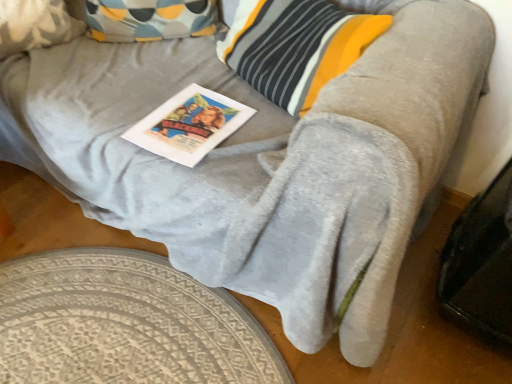
Where is `white paper magazine at center`? white paper magazine at center is located at coordinates (189, 125).

Locate an element on the screen. The height and width of the screenshot is (384, 512). fluffy beige pillow at upper left is located at coordinates 35,25.

What is the approximate height of textured beige rug at lower left?

It is 0.85 inches.

Where is `white paper magazine at center`? white paper magazine at center is located at coordinates (189, 125).

In the scene shown: Is white paper magazine at center wider or thinner than fluffy beige pillow at upper left?

white paper magazine at center is wider than fluffy beige pillow at upper left.

From a real-world perspective, is white paper magazine at center physically below fluffy beige pillow at upper left?

Yes, from a real-world perspective, white paper magazine at center is under fluffy beige pillow at upper left.

Is white paper magazine at center at the right side of fluffy beige pillow at upper left?

Correct, you'll find white paper magazine at center to the right of fluffy beige pillow at upper left.

Would you say white paper magazine at center contains fluffy beige pillow at upper left?

No, white paper magazine at center does not contain fluffy beige pillow at upper left.

From the image's perspective, does fluffy beige pillow at upper left appear lower than textured beige rug at lower left?

Actually, fluffy beige pillow at upper left appears above textured beige rug at lower left in the image.

Is fluffy beige pillow at upper left thinner than textured beige rug at lower left?

Correct, the width of fluffy beige pillow at upper left is less than that of textured beige rug at lower left.

Does point (56, 29) come closer to viewer compared to point (51, 367)?

No, it is not.

The height and width of the screenshot is (384, 512). I want to click on pillow that is above the textured beige rug at lower left (from a real-world perspective), so click(35, 25).

Can you confirm if textured beige rug at lower left is taller than fluffy beige pillow at upper left?

No.

Is point (117, 343) in front of point (31, 40)?

Yes, it is.

Is fluffy beige pillow at upper left a part of textured beige rug at lower left?

No, textured beige rug at lower left does not contain fluffy beige pillow at upper left.

Is point (216, 140) more distant than point (75, 325)?

That is False.

Considering the positions of objects white paper magazine at center and textured beige rug at lower left in the image provided, who is more to the right, white paper magazine at center or textured beige rug at lower left?

From the viewer's perspective, white paper magazine at center appears more on the right side.

Measure the distance from white paper magazine at center to textured beige rug at lower left.

white paper magazine at center is 18.06 inches away from textured beige rug at lower left.

Which object is further away from the camera taking this photo, white paper magazine at center or textured beige rug at lower left?

white paper magazine at center is behind.

Is textured beige rug at lower left oriented away from white paper magazine at center?

No.

Is white paper magazine at center surrounded by textured beige rug at lower left?

No, white paper magazine at center is not inside textured beige rug at lower left.

Is textured beige rug at lower left closer to camera compared to white paper magazine at center?

Yes.

Considering the relative sizes of textured beige rug at lower left and white paper magazine at center in the image provided, is textured beige rug at lower left bigger than white paper magazine at center?

Yes.

Considering the sizes of objects fluffy beige pillow at upper left and white paper magazine at center in the image provided, who is smaller, fluffy beige pillow at upper left or white paper magazine at center?

white paper magazine at center is smaller.

Would you say white paper magazine at center is part of fluffy beige pillow at upper left's contents?

No, white paper magazine at center is located outside of fluffy beige pillow at upper left.

Considering the relative sizes of fluffy beige pillow at upper left and white paper magazine at center in the image provided, is fluffy beige pillow at upper left thinner than white paper magazine at center?

Correct, the width of fluffy beige pillow at upper left is less than that of white paper magazine at center.

Could you tell me if fluffy beige pillow at upper left is facing white paper magazine at center?

Yes, fluffy beige pillow at upper left faces towards white paper magazine at center.

There is a white paper magazine at center. Where is `pillow above it (from a real-world perspective)`? pillow above it (from a real-world perspective) is located at coordinates (35, 25).

Locate an element on the screen. round table in front of the fluffy beige pillow at upper left is located at coordinates 125,324.

From the image, which object appears to be nearer to white paper magazine at center, fluffy beige pillow at upper left or textured beige rug at lower left?

textured beige rug at lower left is closer to white paper magazine at center.

Looking at the image, which one is located closer to fluffy beige pillow at upper left, textured beige rug at lower left or white paper magazine at center?

white paper magazine at center.

Looking at the image, which one is located further to white paper magazine at center, textured beige rug at lower left or fluffy beige pillow at upper left?

fluffy beige pillow at upper left lies further to white paper magazine at center than the other object.

From the picture: Considering their positions, is fluffy beige pillow at upper left positioned further to textured beige rug at lower left than white paper magazine at center?

fluffy beige pillow at upper left is further to textured beige rug at lower left.

From the image, which object appears to be farther from textured beige rug at lower left, white paper magazine at center or fluffy beige pillow at upper left?

The object further to textured beige rug at lower left is fluffy beige pillow at upper left.

Which object lies nearer to the anchor point fluffy beige pillow at upper left, white paper magazine at center or textured beige rug at lower left?

white paper magazine at center.

You are a GUI agent. You are given a task and a screenshot of the screen. Output one action in this format:
    pyautogui.click(x=<x>, y=<y>)
    Task: Click on the magazine that lies between fluffy beige pillow at upper left and textured beige rug at lower left from top to bottom
    
    Given the screenshot: What is the action you would take?
    pyautogui.click(x=189, y=125)